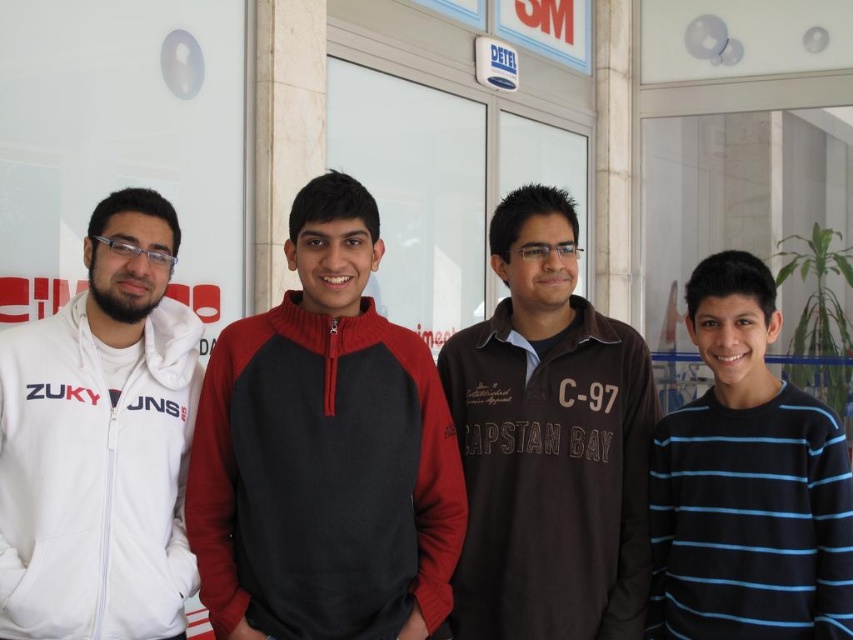
You are a photographer setting up a shoot outside the glass door with the text and logos. You need to ensure that both the dark gray fleece sweatshirt at center and the blue striped sweater at right are clearly visible in the frame. Based on their positions, which clothing item is lower in the image?

The dark gray fleece sweatshirt at center is below the blue striped sweater at right, so the dark gray fleece sweatshirt at center is lower in the image.

You are a photographer trying to capture a group photo of the brown cotton shirt at center and the blue striped sweater at right. Since you want to ensure both subjects are in focus, you need to know their heights. Which of the two is taller?

The brown cotton shirt at center is much taller than the blue striped sweater at right.